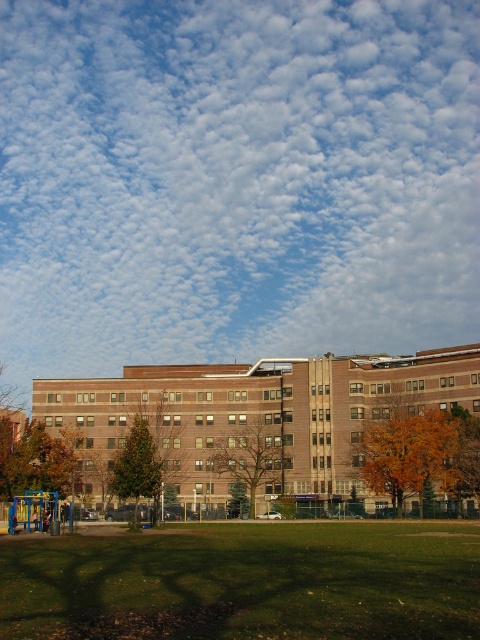
Can you confirm if white fluffy cloud at upper center is thinner than green grass at lower center?

In fact, white fluffy cloud at upper center might be wider than green grass at lower center.

Does white fluffy cloud at upper center appear under green grass at lower center?

No.

I want to click on white fluffy cloud at upper center, so [235, 180].

Find the location of a particular element. The image size is (480, 640). white fluffy cloud at upper center is located at coordinates (235, 180).

Between green grass at lower center and green matte tree at center, which one is positioned lower?

Positioned lower is green grass at lower center.

Does point (106, 547) lie in front of point (139, 458)?

Yes, point (106, 547) is in front of point (139, 458).

What are the coordinates of `green grass at lower center` in the screenshot? It's located at (245, 582).

Find the location of a particular element. The image size is (480, 640). green grass at lower center is located at coordinates (245, 582).

Who is more forward, (52, 634) or (444, 484)?

Point (52, 634) is in front.

Measure the distance between point [8,614] and camera.

Point [8,614] is 32.19 meters away from camera.

The width and height of the screenshot is (480, 640). I want to click on green grass at lower center, so click(x=245, y=582).